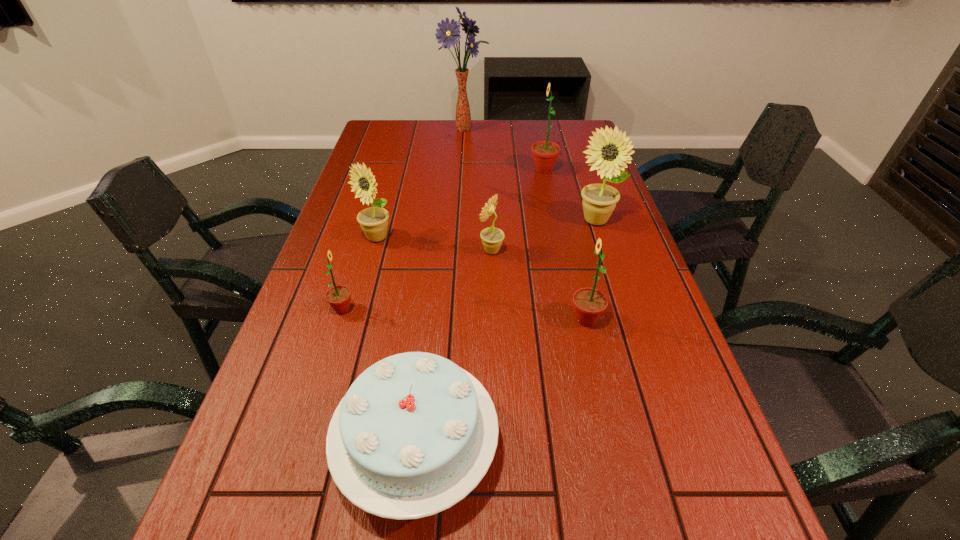
Find the location of a particular element. the tallest object is located at coordinates (448, 33).

You are a GUI agent. You are given a task and a screenshot of the screen. Output one action in this format:
    pyautogui.click(x=<x>, y=<y>)
    Task: Click on the farthest object
    This screenshot has height=540, width=960.
    Given the screenshot: What is the action you would take?
    pyautogui.click(x=448, y=33)

You are a GUI agent. You are given a task and a screenshot of the screen. Output one action in this format:
    pyautogui.click(x=<x>, y=<y>)
    Task: Click on the farthest green sunflower
    The image size is (960, 540).
    Given the screenshot: What is the action you would take?
    pyautogui.click(x=545, y=153)

Image resolution: width=960 pixels, height=540 pixels. I want to click on the second farthest object, so click(545, 153).

The image size is (960, 540). Find the location of `the rightmost yellow sunflower`. the rightmost yellow sunflower is located at coordinates (609, 150).

Where is `the second smallest green sunflower`? This screenshot has width=960, height=540. the second smallest green sunflower is located at coordinates (589, 303).

Locate an element on the screen. The height and width of the screenshot is (540, 960). the leftmost yellow sunflower is located at coordinates (374, 221).

At what (x,y) coordinates should I click in order to perform the action: click on the third sunflower from left to right. Please return your answer as a coordinate pair (x, y). This screenshot has height=540, width=960. Looking at the image, I should click on (492, 238).

Identify the location of the second yellow sunflower from right to left. (492, 238).

Where is `the smallest green sunflower`? Image resolution: width=960 pixels, height=540 pixels. the smallest green sunflower is located at coordinates (338, 297).